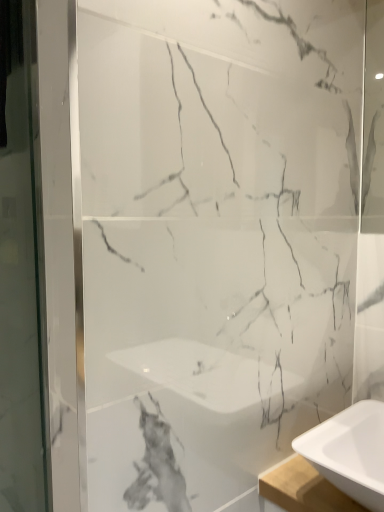
Question: Is point (6, 6) closer or farther from the camera than point (377, 478)?

Choices:
 (A) closer
 (B) farther

Answer: (A)

Question: From the image's perspective, relative to white glossy sink at lower right, is transparent glass screen door at left above or below?

Choices:
 (A) below
 (B) above

Answer: (B)

Question: In terms of width, does transparent glass screen door at left look wider or thinner when compared to white glossy sink at lower right?

Choices:
 (A) thin
 (B) wide

Answer: (A)

Question: Is white glossy sink at lower right inside the boundaries of transparent glass screen door at left, or outside?

Choices:
 (A) inside
 (B) outside

Answer: (B)

Question: Does point click(372, 440) appear closer or farther from the camera than point click(33, 446)?

Choices:
 (A) farther
 (B) closer

Answer: (B)

Question: In the image, is white glossy sink at lower right positioned in front of or behind transparent glass screen door at left?

Choices:
 (A) front
 (B) behind

Answer: (B)

Question: Visually, is white glossy sink at lower right positioned to the left or to the right of transparent glass screen door at left?

Choices:
 (A) right
 (B) left

Answer: (A)